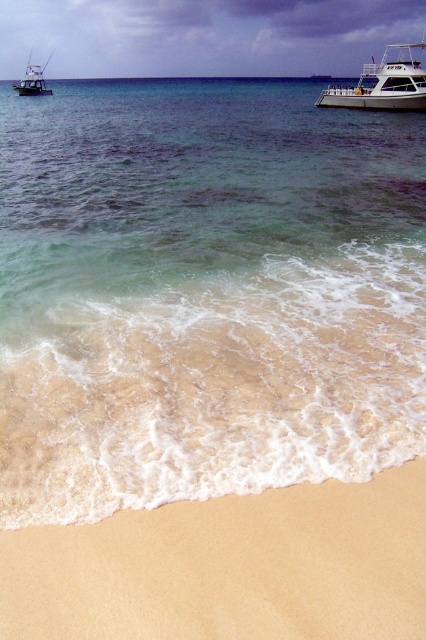
You are standing on the beige sandy beach at lower center and want to reach the brushed metal boat at upper left. Which direction should you walk to get closer to the boat?

You should walk towards the upper left direction to reach the brushed metal boat at upper left since it is located in that direction and the beige sandy beach at lower center is closer to the viewer than the boat.

You are standing on the beach and want to walk from the brushed metal boat at upper left to the clear water at center. Which direction should you head towards?

The clear water at center is to the right of the brushed metal boat at upper left, so you should head towards the right.